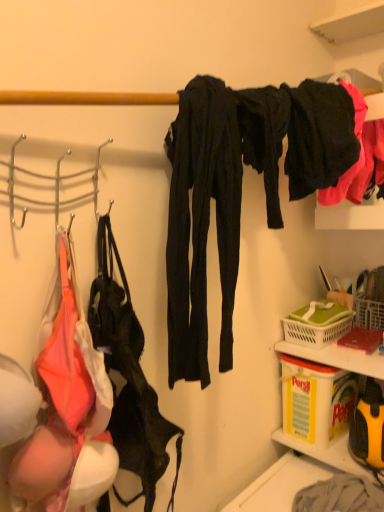
Question: Can you confirm if black matte pants at upper right, the second clothing from the left, is positioned to the left of leather-like black handbag at left?

Choices:
 (A) yes
 (B) no

Answer: (B)

Question: Can leather-like black handbag at left be found inside black matte pants at upper right, the second clothing from the left?

Choices:
 (A) no
 (B) yes

Answer: (A)

Question: Does black matte pants at upper right, the second clothing from the left, come behind leather-like black handbag at left?

Choices:
 (A) no
 (B) yes

Answer: (B)

Question: From the image's perspective, is black matte pants at upper right, the first clothing from the right, below leather-like black handbag at left?

Choices:
 (A) yes
 (B) no

Answer: (B)

Question: Considering the relative sizes of black matte pants at upper right, the first clothing from the right, and leather-like black handbag at left in the image provided, is black matte pants at upper right, the first clothing from the right, wider than leather-like black handbag at left?

Choices:
 (A) no
 (B) yes

Answer: (B)

Question: Visually, is green plastic basket at lower right positioned to the left or to the right of black matte pants at upper right, the second clothing from the left?

Choices:
 (A) left
 (B) right

Answer: (B)

Question: Is green plastic basket at lower right spatially inside black matte pants at upper right, the second clothing from the left, or outside of it?

Choices:
 (A) outside
 (B) inside

Answer: (A)

Question: Is green plastic basket at lower right taller or shorter than black matte pants at upper right, the second clothing from the left?

Choices:
 (A) tall
 (B) short

Answer: (B)

Question: Relative to black matte pants at upper right, the first clothing from the right, is green plastic basket at lower right in front or behind?

Choices:
 (A) behind
 (B) front

Answer: (A)

Question: Based on their sizes in the image, would you say matte black pants at center, acting as the 2th clothing starting from the right, is bigger or smaller than yellow plastic container at lower right?

Choices:
 (A) small
 (B) big

Answer: (B)

Question: Is matte black pants at center, acting as the 2th clothing starting from the right, in front of or behind yellow plastic container at lower right in the image?

Choices:
 (A) behind
 (B) front

Answer: (B)

Question: From the image's perspective, is matte black pants at center, acting as the 2th clothing starting from the right, located above or below yellow plastic container at lower right?

Choices:
 (A) above
 (B) below

Answer: (A)

Question: Is matte black pants at center, which is counted as the 1th clothing, starting from the left, to the left or to the right of yellow plastic container at lower right in the image?

Choices:
 (A) left
 (B) right

Answer: (A)

Question: Is black matte pants at upper right, the first clothing from the right, taller or shorter than yellow plastic container at lower right?

Choices:
 (A) short
 (B) tall

Answer: (B)

Question: From a real-world perspective, is black matte pants at upper right, the second clothing from the left, positioned above or below yellow plastic container at lower right?

Choices:
 (A) below
 (B) above

Answer: (B)